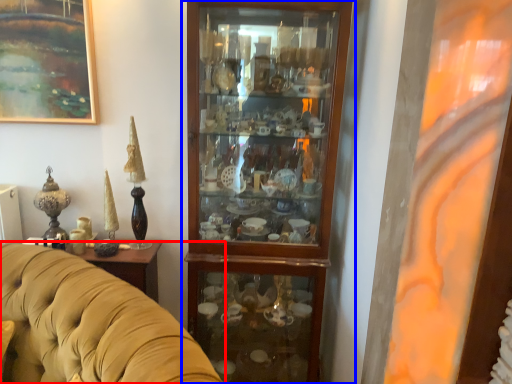
Question: Which object appears farthest to the camera in this image, studio couch (highlighted by a red box) or cupboard (highlighted by a blue box)?

Choices:
 (A) studio couch
 (B) cupboard

Answer: (B)